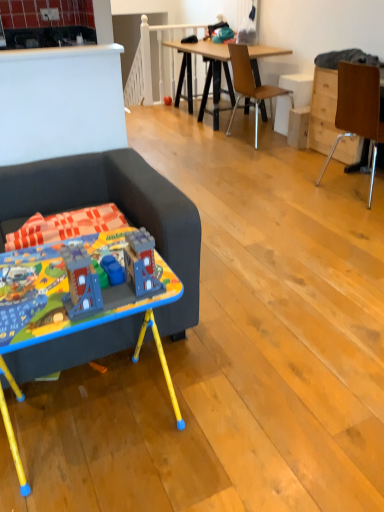
You are a GUI agent. You are given a task and a screenshot of the screen. Output one action in this format:
    pyautogui.click(x=<x>, y=<y>)
    Task: Click on the empty space that is ontop of blue plastic desk at lower left (from a real-world perspective)
    
    Given the screenshot: What is the action you would take?
    pyautogui.click(x=53, y=275)